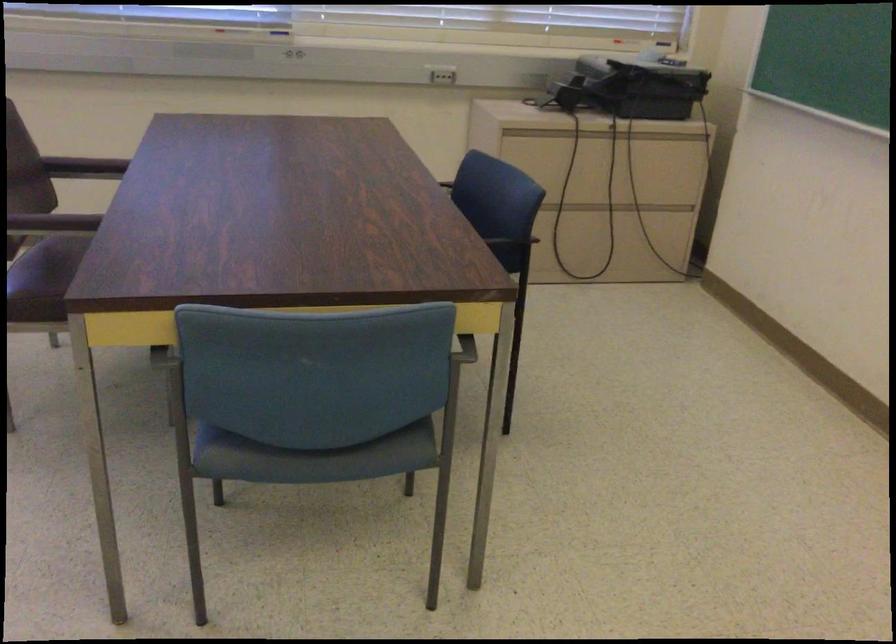
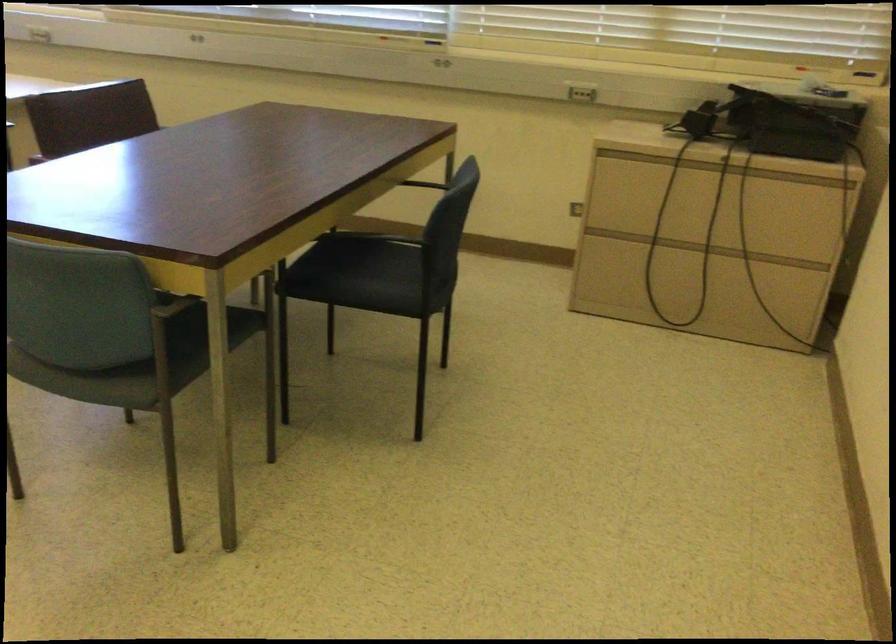
Question: The images are taken continuously from a first-person perspective. In which direction are you moving?

Choices:
 (A) Left
 (B) Right
 (C) Forward
 (D) Backward

Answer: (B)